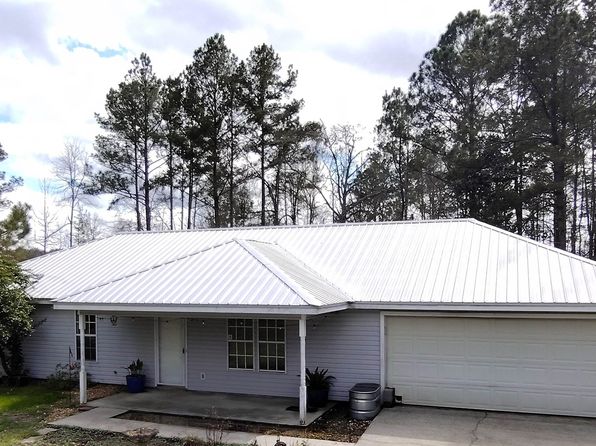
Identify the location of door h andle. (183, 351).